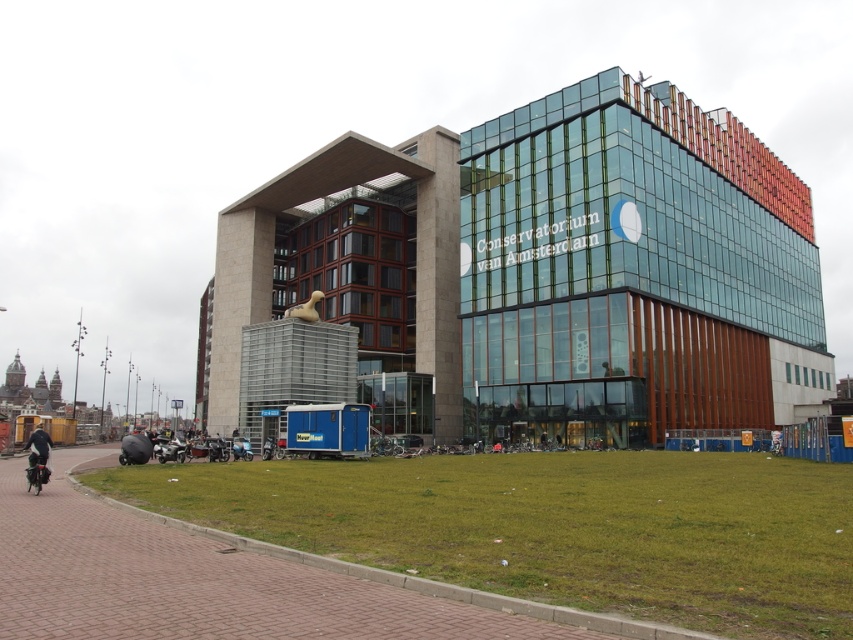
Which of these two, dark blue jacket at lower left or shiny chrome motorcycle at lower left, stands taller?

Standing taller between the two is dark blue jacket at lower left.

At what (x,y) coordinates should I click in order to perform the action: click on dark blue jacket at lower left. Please return your answer as a coordinate pair (x, y). This screenshot has width=853, height=640. Looking at the image, I should click on (38, 445).

Which is in front, point (45, 464) or point (163, 460)?

Point (45, 464) is in front.

Locate an element on the screen. dark blue jacket at lower left is located at coordinates (38, 445).

Measure the distance between point (99, 525) and camera.

They are 17.20 meters apart.

Looking at this image, does brick pavement at lower left have a greater width compared to dark blue jacket at lower left?

No, brick pavement at lower left is not wider than dark blue jacket at lower left.

Image resolution: width=853 pixels, height=640 pixels. What do you see at coordinates (227, 580) in the screenshot?
I see `brick pavement at lower left` at bounding box center [227, 580].

Where is `brick pavement at lower left`? The width and height of the screenshot is (853, 640). brick pavement at lower left is located at coordinates (227, 580).

How much distance is there between brick pavement at lower left and shiny chrome motorcycle at lower left?

The distance of brick pavement at lower left from shiny chrome motorcycle at lower left is 21.20 meters.

Who is lower down, brick pavement at lower left or shiny chrome motorcycle at lower left?

shiny chrome motorcycle at lower left is below.

Between point (223, 556) and point (177, 442), which one is positioned behind?

The point (177, 442) is more distant.

Identify the location of brick pavement at lower left. coord(227,580).